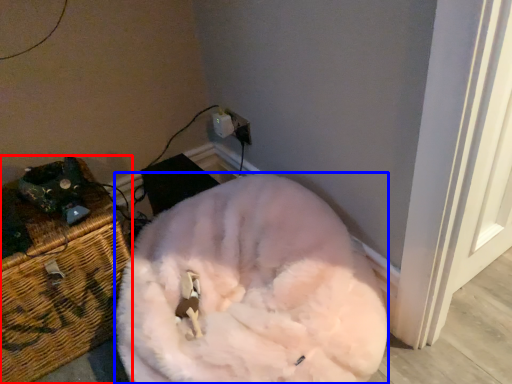
Question: Which object appears farthest to the camera in this image, furniture (highlighted by a red box) or animal (highlighted by a blue box)?

Choices:
 (A) furniture
 (B) animal

Answer: (A)